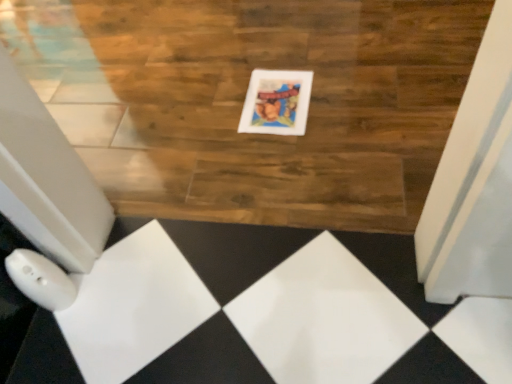
You are a GUI agent. You are given a task and a screenshot of the screen. Output one action in this format:
    pyautogui.click(x=<x>, y=<y>)
    Task: Click on the free space in front of white glossy picture frame at center
    This screenshot has width=512, height=384.
    Given the screenshot: What is the action you would take?
    pyautogui.click(x=291, y=153)